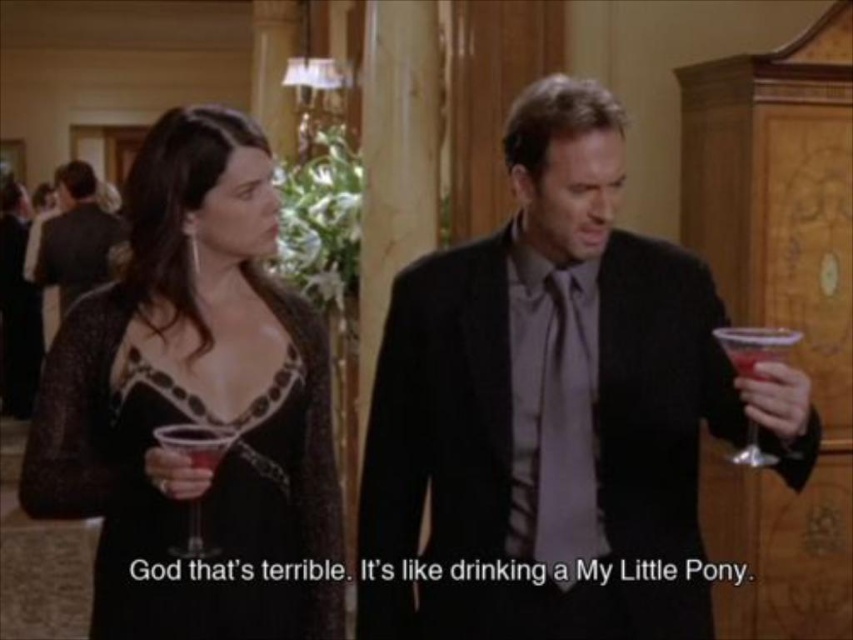
Consider the image. You are a photographer at a formal event. You need to position two subjects, the black lace dress at center and the matte black suit at center, for a group photo. Considering their widths, which subject should be placed closer to the edge to avoid overcrowding the frame?

The black lace dress at center is thinner than the matte black suit at center, so placing the black lace dress at center closer to the edge would help avoid overcrowding the frame since it takes up less space.

You are a bartender at a formal event and need to place a drink on a table between the matte black suit at center and the transparent plastic wine glass at right. Which object should you avoid placing the drink near to prevent it from being knocked over?

You should avoid placing the drink near the matte black suit at center because it has a larger size compared to the transparent plastic wine glass at right, making it more likely to accidentally knock over the drink.

You are a photographer at a formal event. You need to capture a photo of the matte black suit at center and the translucent glass wine glass at center. Which object should you focus on first if you want to include both in the frame without moving the camera?

The matte black suit at center is positioned on the left side of the translucent glass wine glass at center, so you should focus on the matte black suit at center first to ensure both are in the frame.